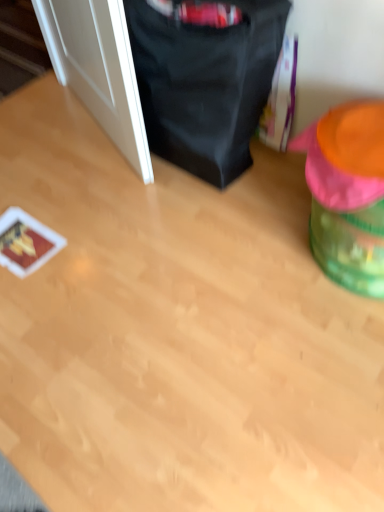
This screenshot has width=384, height=512. Describe the element at coordinates (347, 194) in the screenshot. I see `green plastic bean bag chair at right, the 2th bean bag chair viewed from the left` at that location.

Where is `black fabric bean bag chair at upper center, placed as the 1th bean bag chair when sorted from left to right`? black fabric bean bag chair at upper center, placed as the 1th bean bag chair when sorted from left to right is located at coordinates (205, 83).

Between point (120, 80) and point (302, 133), which one is positioned in front?

The point (120, 80) is more forward.

Looking at the image, does white glossy door at left seem bigger or smaller compared to green plastic bean bag chair at right, which is counted as the first bean bag chair, starting from the right?

Clearly, white glossy door at left is smaller in size than green plastic bean bag chair at right, which is counted as the first bean bag chair, starting from the right.

Looking at this image, who is taller, white glossy door at left or green plastic bean bag chair at right, which is counted as the first bean bag chair, starting from the right?

With more height is white glossy door at left.

Is white glossy door at left oriented towards green plastic bean bag chair at right, the 2th bean bag chair viewed from the left?

No, white glossy door at left is not aimed at green plastic bean bag chair at right, the 2th bean bag chair viewed from the left.

You are a GUI agent. You are given a task and a screenshot of the screen. Output one action in this format:
    pyautogui.click(x=<x>, y=<y>)
    Task: Click on the 1st bean bag chair directly beneath the white glossy door at left (from a real-world perspective)
    The height and width of the screenshot is (512, 384).
    Given the screenshot: What is the action you would take?
    pyautogui.click(x=205, y=83)

Which object is further away from the camera taking this photo, black fabric bean bag chair at upper center, placed as the 1th bean bag chair when sorted from left to right, or white glossy door at left?

white glossy door at left is further from the camera.

From the image's perspective, which is below, black fabric bean bag chair at upper center, placed as the 1th bean bag chair when sorted from left to right, or white glossy door at left?

black fabric bean bag chair at upper center, placed as the 1th bean bag chair when sorted from left to right, appears lower in the image.

From a real-world perspective, is black fabric bean bag chair at upper center, placed as the 1th bean bag chair when sorted from left to right, above or below white glossy door at left?

In terms of real-world spatial position, black fabric bean bag chair at upper center, placed as the 1th bean bag chair when sorted from left to right, is below white glossy door at left.

Is white glossy door at left aimed at black fabric bean bag chair at upper center, placed as the 1th bean bag chair when sorted from left to right?

No.

Which is behind, white glossy door at left or black fabric bean bag chair at upper center, placed as the 1th bean bag chair when sorted from left to right?

white glossy door at left is behind.

From a real-world perspective, who is located lower, white glossy door at left or black fabric bean bag chair at upper center, the second bean bag chair from the right?

From a 3D spatial view, black fabric bean bag chair at upper center, the second bean bag chair from the right, is below.

How different are the orientations of white glossy door at left and black fabric bean bag chair at upper center, the second bean bag chair from the right, in degrees?

The angle between the facing direction of white glossy door at left and the facing direction of black fabric bean bag chair at upper center, the second bean bag chair from the right, is 20.9 degrees.

Does green plastic bean bag chair at right, which is counted as the first bean bag chair, starting from the right, have a greater height compared to black fabric bean bag chair at upper center, the second bean bag chair from the right?

No, green plastic bean bag chair at right, which is counted as the first bean bag chair, starting from the right, is not taller than black fabric bean bag chair at upper center, the second bean bag chair from the right.

Can you confirm if green plastic bean bag chair at right, the 2th bean bag chair viewed from the left, is positioned to the left of black fabric bean bag chair at upper center, the second bean bag chair from the right?

In fact, green plastic bean bag chair at right, the 2th bean bag chair viewed from the left, is to the right of black fabric bean bag chair at upper center, the second bean bag chair from the right.

Would you say green plastic bean bag chair at right, the 2th bean bag chair viewed from the left, is a long distance from black fabric bean bag chair at upper center, placed as the 1th bean bag chair when sorted from left to right?

No.

Between green plastic bean bag chair at right, the 2th bean bag chair viewed from the left, and black fabric bean bag chair at upper center, the second bean bag chair from the right, which one has larger width?

green plastic bean bag chair at right, the 2th bean bag chair viewed from the left, is wider.

Does point (368, 193) come farther from viewer compared to point (125, 119)?

No, (368, 193) is in front of (125, 119).

Does green plastic bean bag chair at right, which is counted as the first bean bag chair, starting from the right, have a greater width compared to white glossy door at left?

Correct, the width of green plastic bean bag chair at right, which is counted as the first bean bag chair, starting from the right, exceeds that of white glossy door at left.

Which of these two, green plastic bean bag chair at right, which is counted as the first bean bag chair, starting from the right, or white glossy door at left, is bigger?

With larger size is green plastic bean bag chair at right, which is counted as the first bean bag chair, starting from the right.

Between black fabric bean bag chair at upper center, the second bean bag chair from the right, and green plastic bean bag chair at right, which is counted as the first bean bag chair, starting from the right, which one has larger width?

green plastic bean bag chair at right, which is counted as the first bean bag chair, starting from the right, is wider.

At what (x,y) coordinates should I click in order to perform the action: click on bean bag chair below the black fabric bean bag chair at upper center, placed as the 1th bean bag chair when sorted from left to right (from a real-world perspective). Please return your answer as a coordinate pair (x, y). This screenshot has height=512, width=384. Looking at the image, I should click on (347, 194).

Does point (233, 92) lie in front of point (341, 170)?

That is False.

Is the depth of black fabric bean bag chair at upper center, the second bean bag chair from the right, greater than that of green plastic bean bag chair at right, the 2th bean bag chair viewed from the left?

Yes, black fabric bean bag chair at upper center, the second bean bag chair from the right, is behind green plastic bean bag chair at right, the 2th bean bag chair viewed from the left.

Where is `door positioned vertically above the green plastic bean bag chair at right, which is counted as the first bean bag chair, starting from the right (from a real-world perspective)`? door positioned vertically above the green plastic bean bag chair at right, which is counted as the first bean bag chair, starting from the right (from a real-world perspective) is located at coordinates point(98,69).

At what (x,y) coordinates should I click in order to perform the action: click on the 1st bean bag chair in front of the white glossy door at left. Please return your answer as a coordinate pair (x, y). Looking at the image, I should click on (205, 83).

Which object lies nearer to the anchor point black fabric bean bag chair at upper center, placed as the 1th bean bag chair when sorted from left to right, white glossy door at left or green plastic bean bag chair at right, which is counted as the first bean bag chair, starting from the right?

Based on the image, white glossy door at left appears to be nearer to black fabric bean bag chair at upper center, placed as the 1th bean bag chair when sorted from left to right.

Considering their positions, is green plastic bean bag chair at right, which is counted as the first bean bag chair, starting from the right, positioned closer to white glossy door at left than black fabric bean bag chair at upper center, the second bean bag chair from the right?

black fabric bean bag chair at upper center, the second bean bag chair from the right, lies closer to white glossy door at left than the other object.

Which object lies further to the anchor point white glossy door at left, black fabric bean bag chair at upper center, the second bean bag chair from the right, or green plastic bean bag chair at right, the 2th bean bag chair viewed from the left?

green plastic bean bag chair at right, the 2th bean bag chair viewed from the left, is positioned further to the anchor white glossy door at left.

Estimate the real-world distances between objects in this image. Which object is closer to green plastic bean bag chair at right, which is counted as the first bean bag chair, starting from the right, black fabric bean bag chair at upper center, placed as the 1th bean bag chair when sorted from left to right, or white glossy door at left?

black fabric bean bag chair at upper center, placed as the 1th bean bag chair when sorted from left to right, is positioned closer to the anchor green plastic bean bag chair at right, which is counted as the first bean bag chair, starting from the right.

Looking at the image, which one is located closer to green plastic bean bag chair at right, which is counted as the first bean bag chair, starting from the right, white glossy door at left or black fabric bean bag chair at upper center, the second bean bag chair from the right?

Among the two, black fabric bean bag chair at upper center, the second bean bag chair from the right, is located nearer to green plastic bean bag chair at right, which is counted as the first bean bag chair, starting from the right.

From the image, which object appears to be farther from black fabric bean bag chair at upper center, placed as the 1th bean bag chair when sorted from left to right, green plastic bean bag chair at right, which is counted as the first bean bag chair, starting from the right, or white glossy door at left?

Among the two, green plastic bean bag chair at right, which is counted as the first bean bag chair, starting from the right, is located further to black fabric bean bag chair at upper center, placed as the 1th bean bag chair when sorted from left to right.

This screenshot has height=512, width=384. I want to click on bean bag chair located between white glossy door at left and green plastic bean bag chair at right, the 2th bean bag chair viewed from the left, in the left-right direction, so click(205, 83).